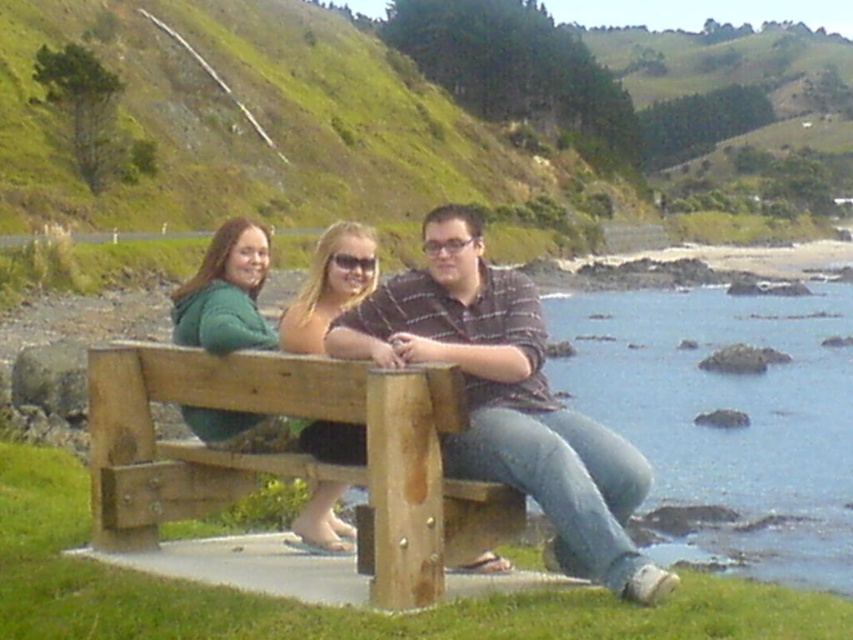
You are standing at the camera position and want to walk towards the two points marked in the image. Which point would you reach first, point (328,477) or point (457,296)?

Point (328,477) is in front of point (457,296), so you would reach point (328,477) first.

You are standing in front of the coastal bench scene. There are two points marked in the image. The first point is at coordinates point [846,330] and the second is at point [248,381]. Which point is closer to you?

Point [846,330] is further to the viewer than point [248,381], so the second point is closer to you.

You are a photographer standing at the edge of the concrete platform. You want to capture a photo of the wooden bench at center and the clear blue water at lower right. Which object appears taller in the photo?

The clear blue water at lower right appears taller in the photo because it has a greater height compared to the wooden bench at center according to the description.